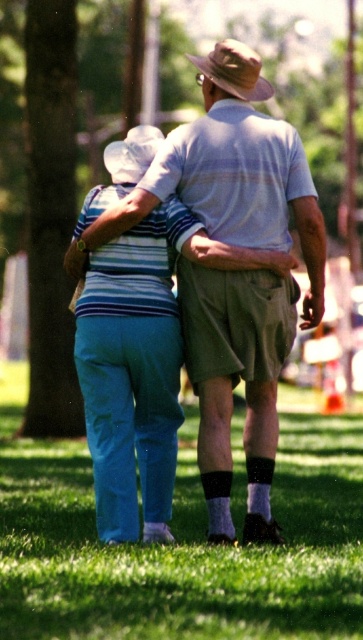
Question: Which point is closer to the camera taking this photo?

Choices:
 (A) coord(250,227)
 (B) coord(219,74)
 (C) coord(343,598)

Answer: (C)

Question: Is green grass at lower center positioned at the back of striped fabric shirt at center?

Choices:
 (A) yes
 (B) no

Answer: (B)

Question: Among these points, which one is farthest from the camera?

Choices:
 (A) (298, 497)
 (B) (264, 132)
 (C) (254, 90)

Answer: (A)

Question: Does striped fabric shirt at center appear under brown felt hat at upper center?

Choices:
 (A) yes
 (B) no

Answer: (A)

Question: Which of the following is the closest to the observer?

Choices:
 (A) (230, 45)
 (B) (178, 621)
 (C) (128, 228)

Answer: (B)

Question: Can you confirm if green grass at lower center is positioned to the left of striped fabric shirt at center?

Choices:
 (A) no
 (B) yes

Answer: (B)